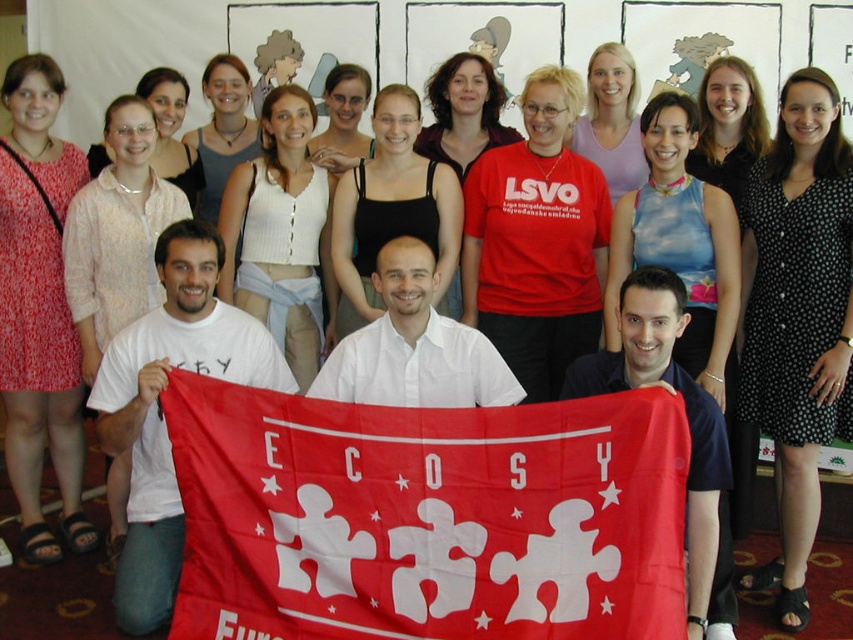
Question: Can you confirm if red fabric flag at center is bigger than black dotted dress at upper right?

Choices:
 (A) yes
 (B) no

Answer: (A)

Question: Observing the image, what is the correct spatial positioning of matte red t-shirt at center in reference to matte pink dress at left?

Choices:
 (A) above
 (B) below

Answer: (A)

Question: Which point is closer to the camera?

Choices:
 (A) click(122, 211)
 (B) click(643, 317)
 (C) click(755, 365)

Answer: (B)

Question: Which of the following is the closest to the observer?

Choices:
 (A) (425, 168)
 (B) (276, 316)
 (C) (152, 192)

Answer: (C)

Question: Which point is closer to the camera taking this photo?

Choices:
 (A) (824, 136)
 (B) (283, 120)

Answer: (A)

Question: From the image, what is the correct spatial relationship of red fabric flag at center in relation to white knit tank top at center?

Choices:
 (A) above
 (B) below

Answer: (B)